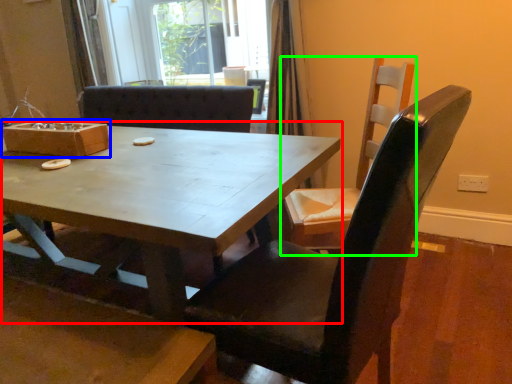
Question: Based on their relative distances, which object is nearer to coffee table (highlighted by a red box)? Choose from box (highlighted by a blue box) and chair (highlighted by a green box).

Choices:
 (A) box
 (B) chair

Answer: (A)